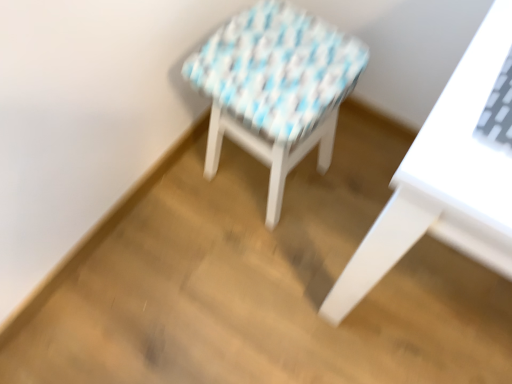
Question: From a real-world perspective, is white woven stool at center located higher than white glossy table at right?

Choices:
 (A) no
 (B) yes

Answer: (A)

Question: Would you say white glossy table at right is part of white woven stool at center's contents?

Choices:
 (A) yes
 (B) no

Answer: (B)

Question: Is white woven stool at center facing away from white glossy table at right?

Choices:
 (A) no
 (B) yes

Answer: (A)

Question: Can you confirm if white woven stool at center is smaller than white glossy table at right?

Choices:
 (A) yes
 (B) no

Answer: (A)

Question: Is white woven stool at center closer to camera compared to white glossy table at right?

Choices:
 (A) yes
 (B) no

Answer: (B)

Question: From the image's perspective, is white woven stool at center under white glossy table at right?

Choices:
 (A) no
 (B) yes

Answer: (A)

Question: Considering the relative sizes of white glossy table at right and white woven stool at center in the image provided, is white glossy table at right shorter than white woven stool at center?

Choices:
 (A) yes
 (B) no

Answer: (B)

Question: Are white glossy table at right and white woven stool at center located far from each other?

Choices:
 (A) no
 (B) yes

Answer: (A)

Question: Considering the relative positions of white glossy table at right and white woven stool at center in the image provided, is white glossy table at right to the right of white woven stool at center from the viewer's perspective?

Choices:
 (A) yes
 (B) no

Answer: (A)

Question: Does white glossy table at right appear on the left side of white woven stool at center?

Choices:
 (A) no
 (B) yes

Answer: (A)

Question: Is white glossy table at right smaller than white woven stool at center?

Choices:
 (A) yes
 (B) no

Answer: (B)

Question: From a real-world perspective, is white glossy table at right on top of white woven stool at center?

Choices:
 (A) no
 (B) yes

Answer: (B)

Question: Is white woven stool at center spatially inside white glossy table at right, or outside of it?

Choices:
 (A) inside
 (B) outside

Answer: (B)